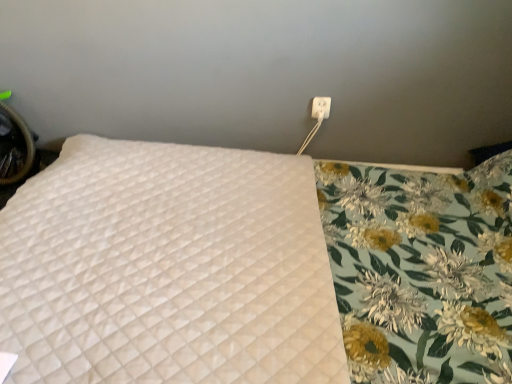
Question: Does white plastic outlet at upper right lie behind white quilted mattress at upper left?

Choices:
 (A) yes
 (B) no

Answer: (A)

Question: Are white plastic outlet at upper right and white quilted mattress at upper left beside each other?

Choices:
 (A) yes
 (B) no

Answer: (B)

Question: Is white plastic outlet at upper right wider than white quilted mattress at upper left?

Choices:
 (A) no
 (B) yes

Answer: (A)

Question: Is white plastic outlet at upper right positioned in front of white quilted mattress at upper left?

Choices:
 (A) yes
 (B) no

Answer: (B)

Question: Is white plastic outlet at upper right far away from white quilted mattress at upper left?

Choices:
 (A) no
 (B) yes

Answer: (A)

Question: Can you confirm if white plastic outlet at upper right is smaller than white quilted mattress at upper left?

Choices:
 (A) yes
 (B) no

Answer: (A)

Question: Considering the relative sizes of white quilted mattress at upper left and white plastic outlet at upper right in the image provided, is white quilted mattress at upper left smaller than white plastic outlet at upper right?

Choices:
 (A) no
 (B) yes

Answer: (A)

Question: Does white quilted mattress at upper left appear on the right side of white plastic outlet at upper right?

Choices:
 (A) no
 (B) yes

Answer: (A)

Question: Is white quilted mattress at upper left outside white plastic outlet at upper right?

Choices:
 (A) yes
 (B) no

Answer: (A)

Question: Can you confirm if white quilted mattress at upper left is thinner than white plastic outlet at upper right?

Choices:
 (A) no
 (B) yes

Answer: (A)

Question: Is white quilted mattress at upper left in front of white plastic outlet at upper right?

Choices:
 (A) yes
 (B) no

Answer: (A)

Question: Is white quilted mattress at upper left positioned with its back to white plastic outlet at upper right?

Choices:
 (A) yes
 (B) no

Answer: (B)

Question: From a real-world perspective, is white plastic outlet at upper right physically located above or below white quilted mattress at upper left?

Choices:
 (A) above
 (B) below

Answer: (A)